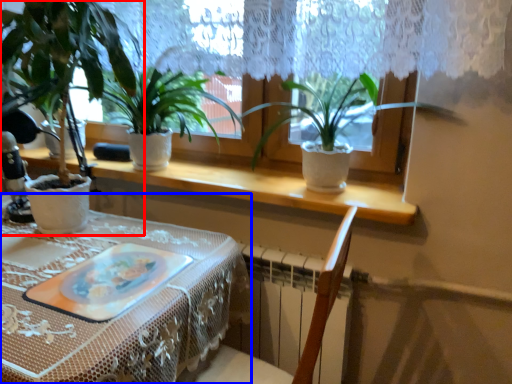
Question: Among these objects, which one is nearest to the camera, houseplant (highlighted by a red box) or table (highlighted by a blue box)?

Choices:
 (A) houseplant
 (B) table

Answer: (B)